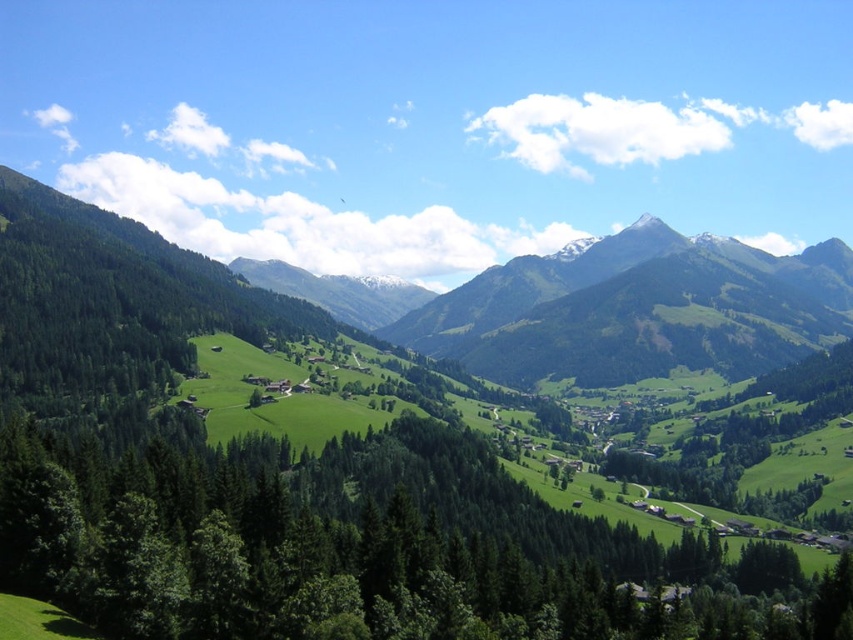
In the scene shown: Who is positioned more to the right, green textured trees at center or green grassy mountain at center?

From the viewer's perspective, green grassy mountain at center appears more on the right side.

Does green textured trees at center have a lesser height compared to green grassy mountain at center?

Yes.

Between point (830, 596) and point (560, 304), which one is positioned behind?

The point (560, 304) is behind.

Locate an element on the screen. The height and width of the screenshot is (640, 853). green textured trees at center is located at coordinates (341, 563).

Is the position of green grassy mountain at left more distant than that of green textured trees at center?

Yes, green grassy mountain at left is behind green textured trees at center.

Who is more forward, (343, 605) or (270, 474)?

Point (343, 605) is more forward.

The width and height of the screenshot is (853, 640). Identify the location of green grassy mountain at left. (297, 484).

Is green grassy mountain at left above green grassy mountain at center?

Incorrect, green grassy mountain at left is not positioned above green grassy mountain at center.

Which is behind, point (149, 545) or point (587, 337)?

Positioned behind is point (587, 337).

In order to click on green grassy mountain at left in this screenshot , I will do `click(297, 484)`.